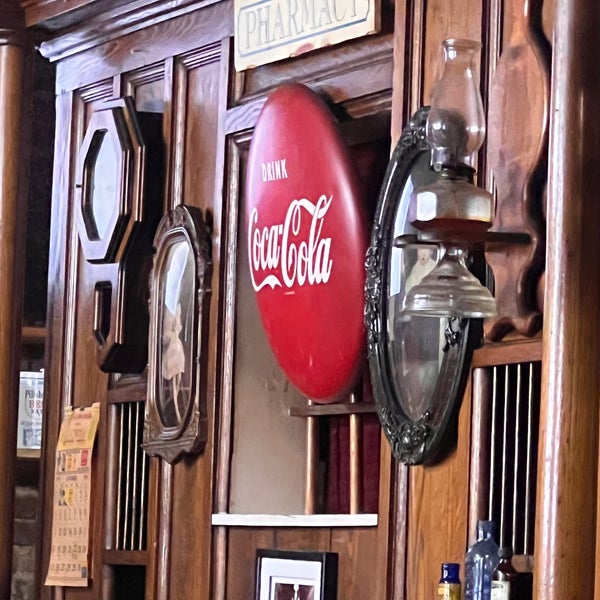
Where is `lamp`? The image size is (600, 600). lamp is located at coordinates (456, 208).